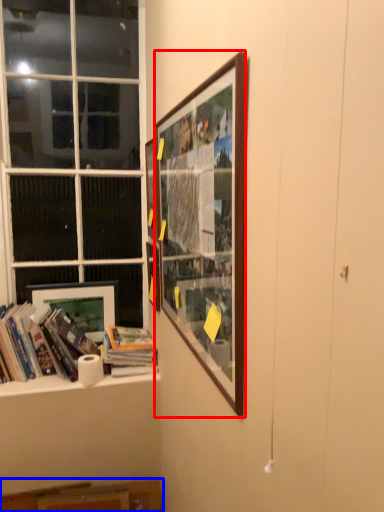
Question: Which object appears farthest to the camera in this image, picture frame (highlighted by a red box) or cabinet (highlighted by a blue box)?

Choices:
 (A) picture frame
 (B) cabinet

Answer: (B)